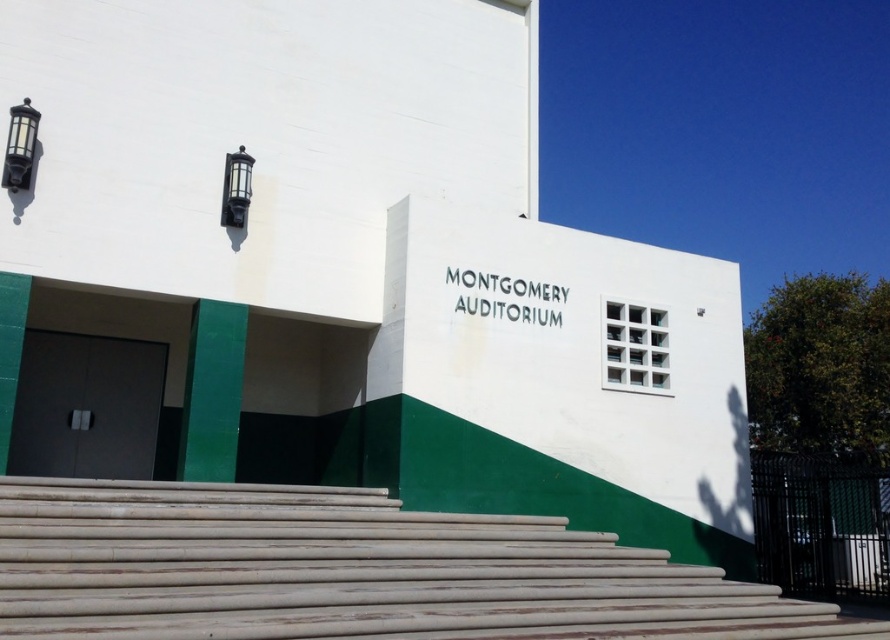
You are a delivery person with a cart that is 5 feet wide. You need to move your cart through the space between the wooden at center and the matte black door at left. Can you fit through the space?

The wooden at center and matte black door at left are 9.66 feet apart. Since your cart is 5 feet wide, you can fit through the space as the distance between them is wider than your cart.

You are standing in front of the Montgomery Auditorium and notice two points marked on the building. The first point is at coordinates point (109, 608) and the second is at point (85, 460). Which of these points is closer to you?

Point (109, 608) is closer to the camera than point (85, 460), so the first point is closer to you.

You are standing in front of the Montgomery Auditorium and need to enter through the entrance. The entrance has a wooden at center and a matte black door at left. Which object is taller?

The matte black door at left is taller than the wooden at center.